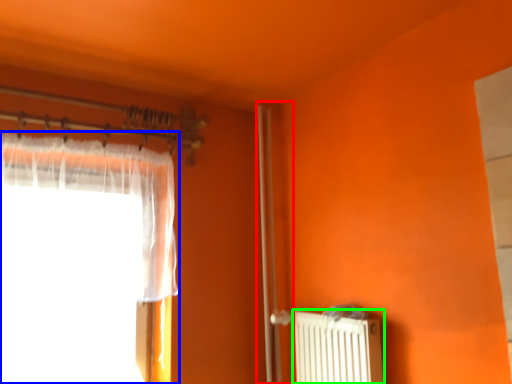
Question: Considering the real-world distances, which object is closest to screen door (highlighted by a red box)? curtain (highlighted by a blue box) or radiator (highlighted by a green box).

Choices:
 (A) curtain
 (B) radiator

Answer: (B)